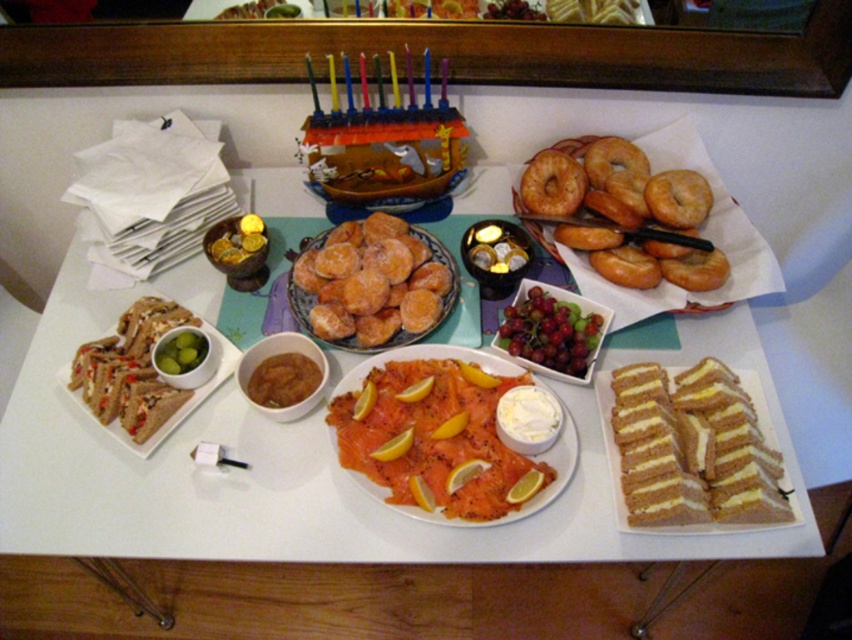
You are a guest at the Hanukkah celebration and want to grab a snack. You see the white bread sandwich at left and the glazed doughnut at upper right. If you are standing at the center of the table, which snack is closer to you?

The white bread sandwich at left is closer to you than the glazed doughnut at upper right because it is only 22.21 inches away from the doughnut, implying the sandwich is nearer to the center.

You are a guest at the Hanukkah celebration and want to reach for the sandwiches to the left of the smoked salmon. However, there is an obstacle at point A and point B on the table. The coordinates of point A are point [493,602] and point B are point [225,339]. Which point is closer to the sandwiches to the left of the smoked salmon?

Point B at [225,339] is closer to the sandwiches to the left of the smoked salmon because it is in front of point A at [493,602], which is further away.